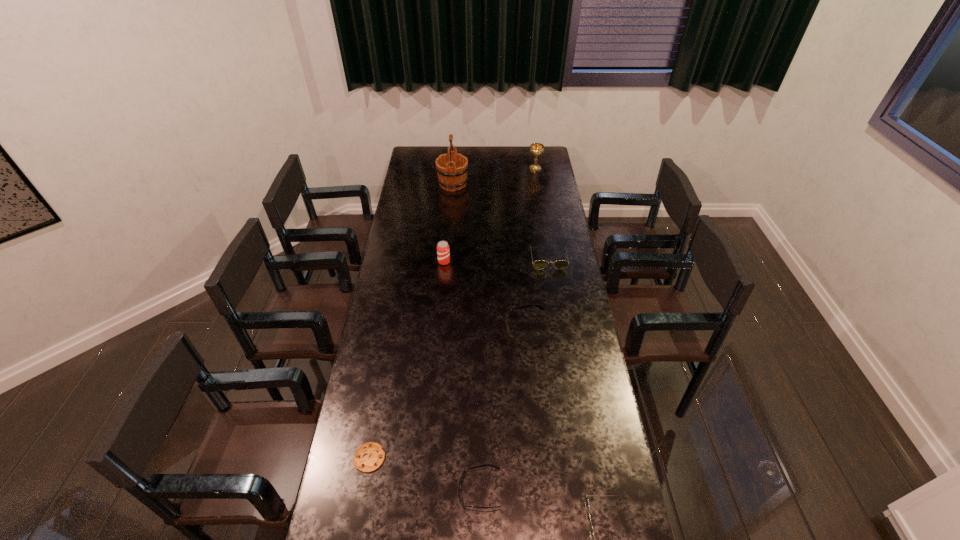
The height and width of the screenshot is (540, 960). Find the location of `blank area located 0.220m on the lenses of the bigger black sunglasses`. blank area located 0.220m on the lenses of the bigger black sunglasses is located at coordinates (451, 328).

Image resolution: width=960 pixels, height=540 pixels. I want to click on vacant space located on the lenses of the leftmost sunglasses, so click(336, 490).

At what (x,y) coordinates should I click in order to perform the action: click on free space located 0.100m on the lenses of the leftmost sunglasses. Please return your answer as a coordinate pair (x, y). The width and height of the screenshot is (960, 540). Looking at the image, I should click on (427, 490).

Where is `vacant position located 0.230m on the lenses of the leftmost sunglasses`? vacant position located 0.230m on the lenses of the leftmost sunglasses is located at coordinates (385, 490).

The height and width of the screenshot is (540, 960). I want to click on free region located on the right of the leftmost object, so click(x=434, y=457).

Where is `object that is positioned at the far edge`? object that is positioned at the far edge is located at coordinates (536, 149).

The image size is (960, 540). What are the coordinates of `object located in the left edge section of the desktop` in the screenshot? It's located at (369, 456).

Locate an element on the screen. The width and height of the screenshot is (960, 540). chalice positioned at the right edge is located at coordinates (536, 149).

Identify the location of sunglasses located in the right edge section of the desktop. coord(539,264).

Image resolution: width=960 pixels, height=540 pixels. In order to click on object that is at the far right corner in this screenshot , I will do `click(536, 149)`.